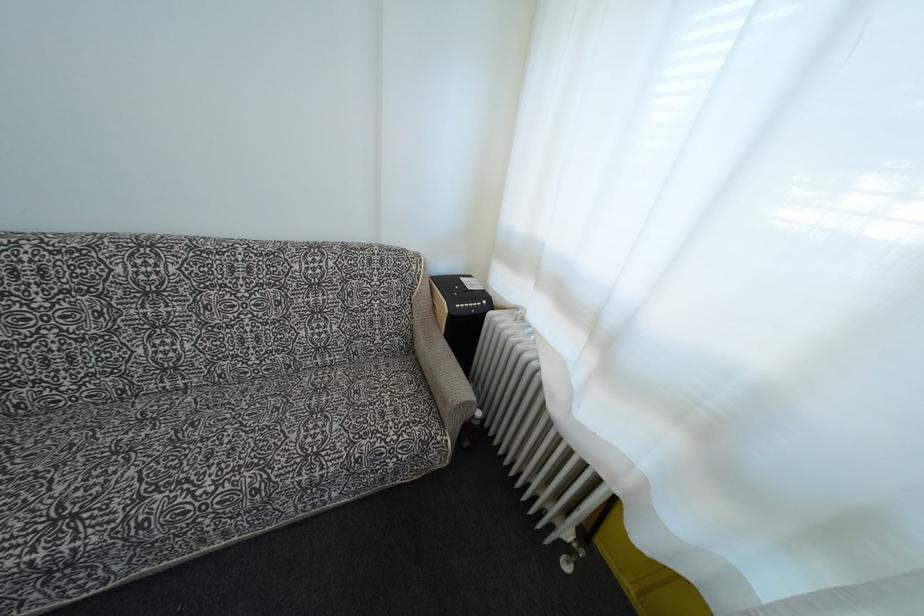
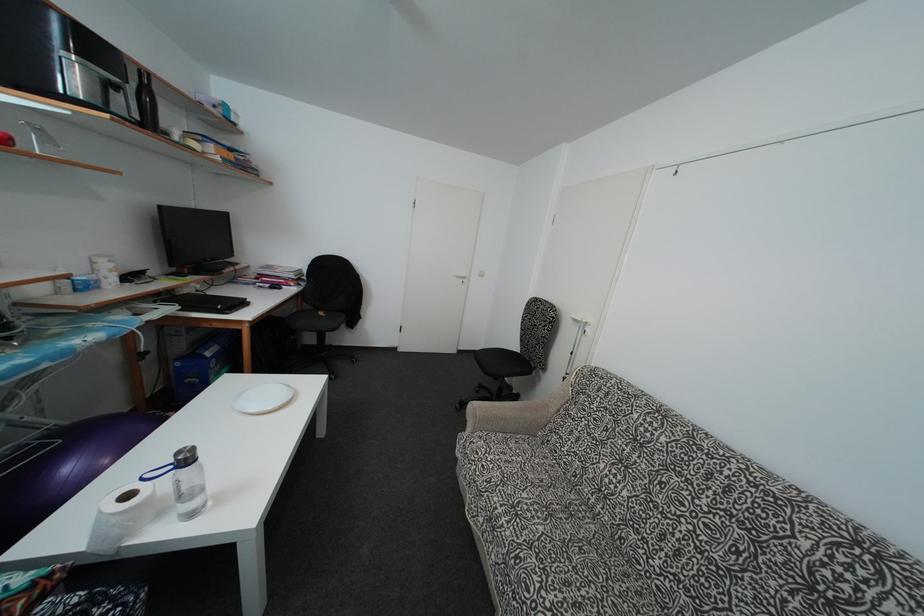
Question: The camera is either moving clockwise (left) or counter-clockwise (right) around the object. The first image is from the beginning of the video and the second image is from the end. Is the camera moving left or right when shooting the video?

Choices:
 (A) Left
 (B) Right

Answer: (B)